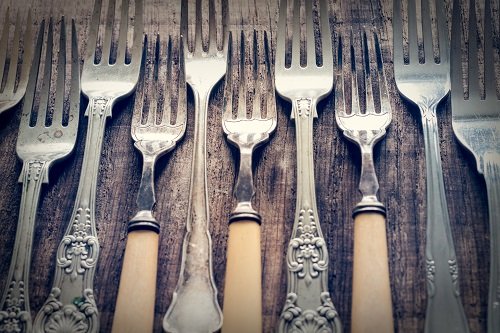
Find the location of a particular element. The height and width of the screenshot is (333, 500). brown handles is located at coordinates (374, 298), (245, 290), (131, 289).